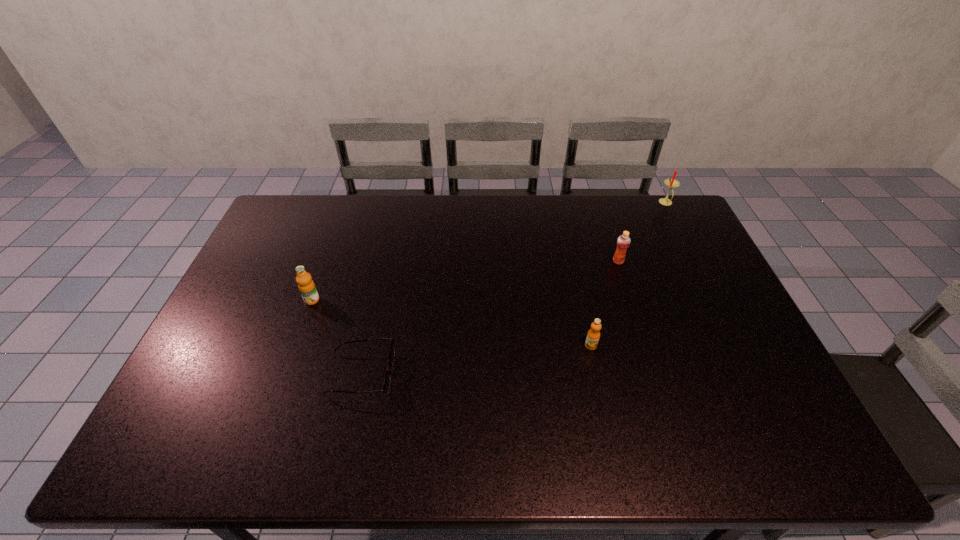
Find the location of a particular element. This screenshot has width=960, height=540. free space between the shortest object and the shortest orange juice is located at coordinates (476, 360).

Image resolution: width=960 pixels, height=540 pixels. Find the location of `vacant area between the second farthest object and the leftmost orange juice`. vacant area between the second farthest object and the leftmost orange juice is located at coordinates (465, 281).

Choose which object is the fourth nearest neighbor to the third nearest object. Please provide its 2D coordinates. Your answer should be formatted as a tuple, i.e. [(x, y)], where the tuple contains the x and y coordinates of a point satisfying the conditions above.

[(671, 183)]

The height and width of the screenshot is (540, 960). What are the coordinates of `object that is the closest one to the fourth object from right to left` in the screenshot? It's located at (306, 286).

Identify which orange juice is located as the second nearest to the second object from left to right. Please provide its 2D coordinates. Your answer should be formatted as a tuple, i.e. [(x, y)], where the tuple contains the x and y coordinates of a point satisfying the conditions above.

[(593, 335)]

Select which orange juice appears as the closest to the nearest orange juice. Please provide its 2D coordinates. Your answer should be formatted as a tuple, i.e. [(x, y)], where the tuple contains the x and y coordinates of a point satisfying the conditions above.

[(623, 242)]

Find the location of a particular element. vacant area in the image that satisfies the following two spatial constraints: 1. on the front side of the candle; 2. on the face of the second object from left to right is located at coordinates (753, 374).

Identify the location of free point that satisfies the following two spatial constraints: 1. on the back side of the fourth object from left to right; 2. on the right side of the farthest object. The width and height of the screenshot is (960, 540). (599, 203).